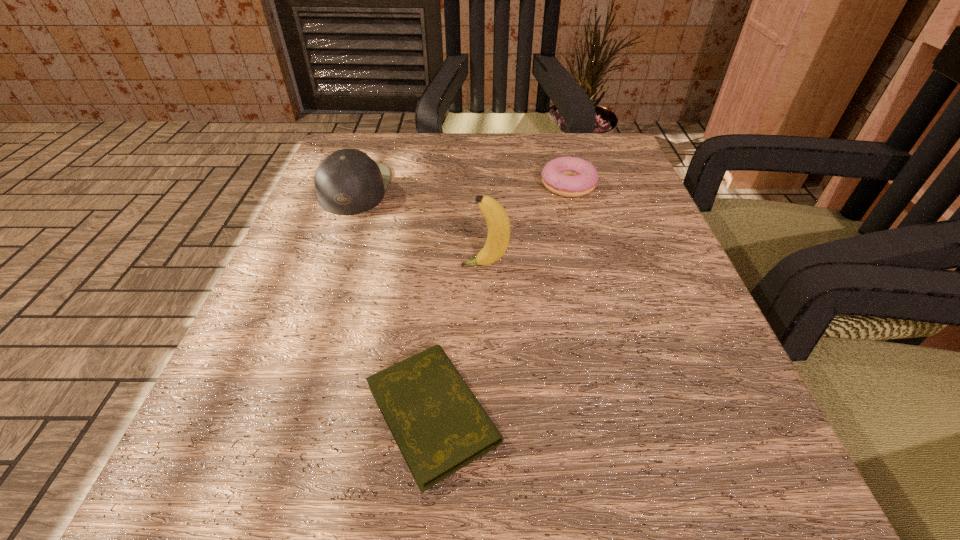
Image resolution: width=960 pixels, height=540 pixels. Find the location of `object at the far right corner`. object at the far right corner is located at coordinates (567, 176).

Where is `vacant space at the far edge of the desktop`? The image size is (960, 540). vacant space at the far edge of the desktop is located at coordinates 493,134.

Locate an element on the screen. The width and height of the screenshot is (960, 540). blank space at the near edge of the desktop is located at coordinates (409, 532).

Find the location of `vacant space at the left edge of the desktop`. vacant space at the left edge of the desktop is located at coordinates pos(324,291).

In the image, there is a desktop. Identify the location of free region at the right edge. This screenshot has width=960, height=540. (658, 246).

The height and width of the screenshot is (540, 960). In order to click on vacant space at the far left corner in this screenshot , I will do `click(349, 144)`.

In the image, there is a desktop. Identify the location of vacant space at the far right corner. This screenshot has width=960, height=540. (617, 164).

Locate an element on the screen. Image resolution: width=960 pixels, height=540 pixels. free space at the near right corner of the desktop is located at coordinates [667, 483].

Where is `unoccupied area between the cap and the doughnut`? unoccupied area between the cap and the doughnut is located at coordinates click(x=462, y=187).

You are a GUI agent. You are given a task and a screenshot of the screen. Output one action in this format:
    pyautogui.click(x=<x>, y=<y>)
    Task: Click on the free space between the shortest object and the second tallest object
    Image resolution: width=960 pixels, height=540 pixels.
    Given the screenshot: What is the action you would take?
    pyautogui.click(x=394, y=301)